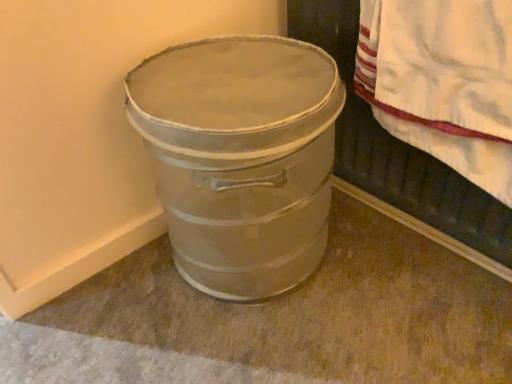
Find the location of `vacant space situated on the left part of metallic gray bucket at lower left`. vacant space situated on the left part of metallic gray bucket at lower left is located at coordinates (102, 313).